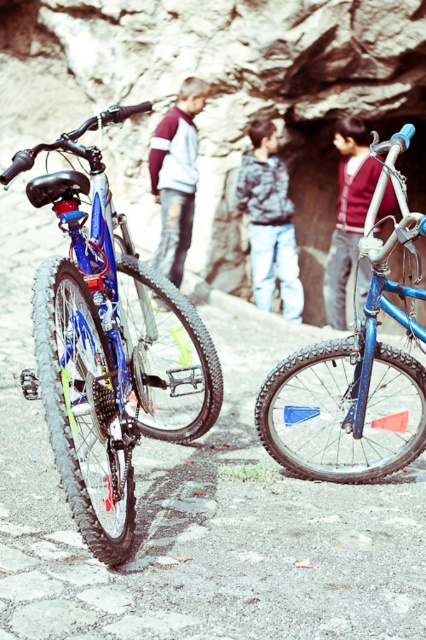
Question: Which point appears closest to the camera in this image?

Choices:
 (A) (267, 419)
 (B) (54, 209)
 (C) (351, 124)
 (D) (258, 259)

Answer: (B)

Question: Can you confirm if shiny metallic bicycle at center is positioned above textured gray hoodie at center?

Choices:
 (A) yes
 (B) no

Answer: (B)

Question: Which point is closer to the camera?

Choices:
 (A) blue matte mountain bike at center
 (B) textured gray hoodie at center
 (C) shiny blue bicycle at left

Answer: (C)

Question: Which of the following is the farthest from the observer?

Choices:
 (A) shiny metallic bicycle at center
 (B) textured gray hoodie at center
 (C) ripped denim jeans at center

Answer: (B)

Question: From the image, what is the correct spatial relationship of shiny blue bicycle at left in relation to blue matte bicycle at center?

Choices:
 (A) above
 (B) below

Answer: (B)

Question: Is the position of textured gray hoodie at center less distant than that of ripped denim jeans at center?

Choices:
 (A) no
 (B) yes

Answer: (A)